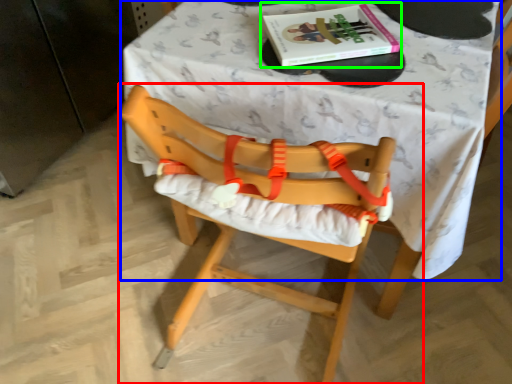
Question: Which object is positioned closest to chair (highlighted by a red box)? Select from table (highlighted by a blue box) and book (highlighted by a green box).

Choices:
 (A) table
 (B) book

Answer: (A)